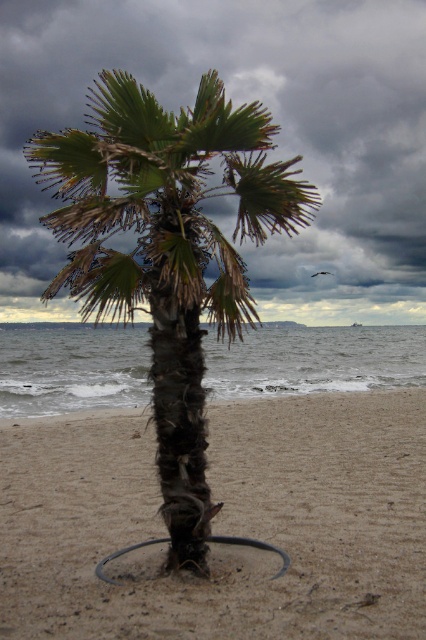
Between brown sandy beach at center and green rough bark palm tree at center, which one appears on the right side from the viewer's perspective?

brown sandy beach at center

Is brown sandy beach at center bigger than green rough bark palm tree at center?

Incorrect, brown sandy beach at center is not larger than green rough bark palm tree at center.

Who is more forward, (x=204, y=604) or (x=137, y=124)?

Point (x=204, y=604) is in front.

At what (x,y) coordinates should I click in order to perform the action: click on brown sandy beach at center. Please return your answer as a coordinate pair (x, y). This screenshot has height=640, width=426. Looking at the image, I should click on (221, 524).

Which is below, dark gray cloud at upper center or green rough bark palm tree at center?

dark gray cloud at upper center is lower down.

Is dark gray cloud at upper center further to the viewer compared to green rough bark palm tree at center?

That is True.

At what (x,y) coordinates should I click in order to perform the action: click on dark gray cloud at upper center. Please return your answer as a coordinate pair (x, y). The width and height of the screenshot is (426, 640). Looking at the image, I should click on (241, 102).

Based on the photo, can you confirm if brown sandy beach at center is thinner than dark gray cloud at upper center?

Correct, brown sandy beach at center's width is less than dark gray cloud at upper center's.

Locate an element on the screen. Image resolution: width=426 pixels, height=640 pixels. brown sandy beach at center is located at coordinates (221, 524).